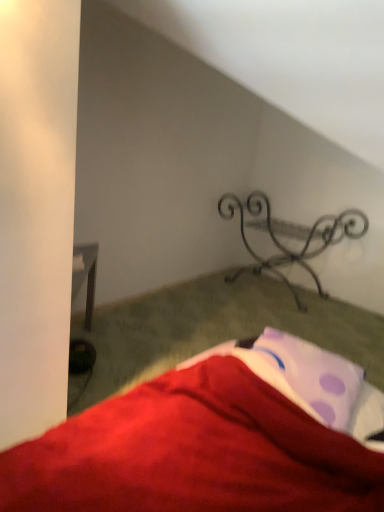
Question: Is metallic wrought iron bench at center to the left of purple dotted fabric at lower right from the viewer's perspective?

Choices:
 (A) yes
 (B) no

Answer: (B)

Question: Does metallic wrought iron bench at center appear on the right side of purple dotted fabric at lower right?

Choices:
 (A) no
 (B) yes

Answer: (B)

Question: Is metallic wrought iron bench at center facing away from purple dotted fabric at lower right?

Choices:
 (A) no
 (B) yes

Answer: (A)

Question: Could purple dotted fabric at lower right be considered to be inside metallic wrought iron bench at center?

Choices:
 (A) yes
 (B) no

Answer: (B)

Question: Can you confirm if metallic wrought iron bench at center is smaller than purple dotted fabric at lower right?

Choices:
 (A) no
 (B) yes

Answer: (A)

Question: Is metallic wrought iron bench at center positioned before purple dotted fabric at lower right?

Choices:
 (A) yes
 (B) no

Answer: (B)

Question: Is purple dotted fabric at lower right far from metallic wrought iron bench at center?

Choices:
 (A) no
 (B) yes

Answer: (B)

Question: From the image's perspective, would you say purple dotted fabric at lower right is shown under metallic wrought iron bench at center?

Choices:
 (A) yes
 (B) no

Answer: (A)

Question: From the image's perspective, is purple dotted fabric at lower right over metallic wrought iron bench at center?

Choices:
 (A) yes
 (B) no

Answer: (B)

Question: Could you tell me if purple dotted fabric at lower right is turned towards metallic wrought iron bench at center?

Choices:
 (A) no
 (B) yes

Answer: (A)

Question: Is purple dotted fabric at lower right smaller than metallic wrought iron bench at center?

Choices:
 (A) yes
 (B) no

Answer: (A)

Question: Is the position of purple dotted fabric at lower right more distant than that of metallic wrought iron bench at center?

Choices:
 (A) no
 (B) yes

Answer: (A)

Question: From their relative heights in the image, would you say metallic wrought iron bench at center is taller or shorter than purple dotted fabric at lower right?

Choices:
 (A) tall
 (B) short

Answer: (A)